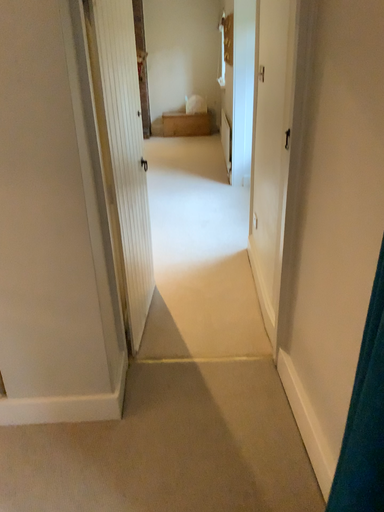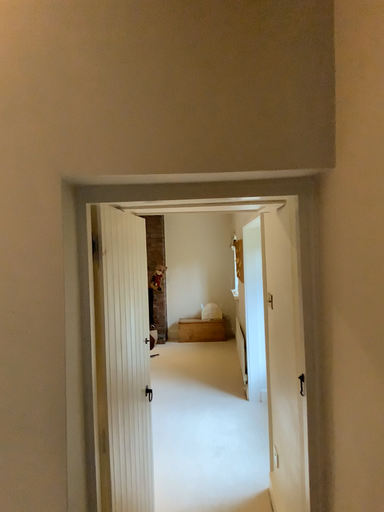
Question: Which way did the camera rotate in the video?

Choices:
 (A) rotated upward
 (B) rotated downward

Answer: (A)